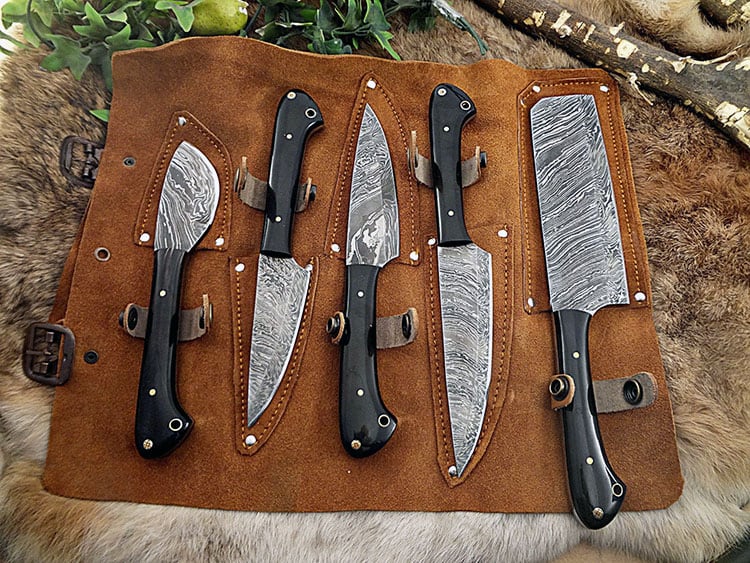
Point to any where you'd hold the knives in the image. Your answer should be formatted as a list of tuples, i.e. [(x1, y1), (x2, y2), ...], where each tuple contains the x and y coordinates of a point satisfying the conditions above.

[(159, 352), (283, 172), (363, 346), (451, 160), (589, 419)]